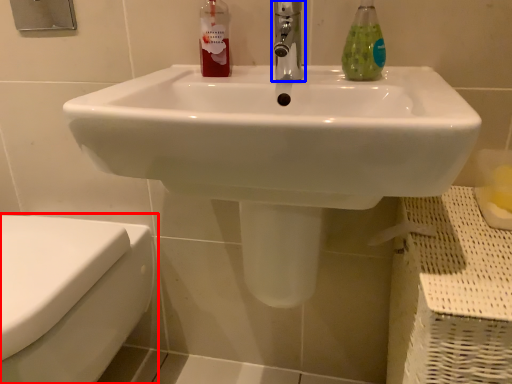
Question: Among these objects, which one is nearest to the camera, toilet (highlighted by a red box) or tap (highlighted by a blue box)?

Choices:
 (A) toilet
 (B) tap

Answer: (A)